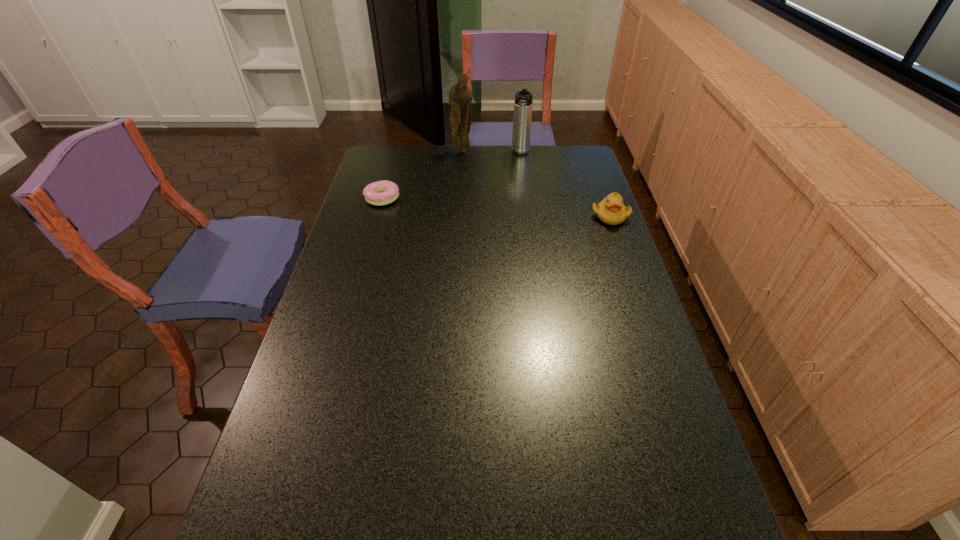
Locate an element on the screen. free space on the desktop that is between the doughnut and the duckling and is positioned on the front-facing side of the third object from right to left is located at coordinates (465, 205).

You are a GUI agent. You are given a task and a screenshot of the screen. Output one action in this format:
    pyautogui.click(x=<x>, y=<y>)
    Task: Click on the vacant spot on the desktop that is between the shortest object and the duckling and is positioned on the handle side of the second tallest object
    The height and width of the screenshot is (540, 960).
    Given the screenshot: What is the action you would take?
    pyautogui.click(x=509, y=208)